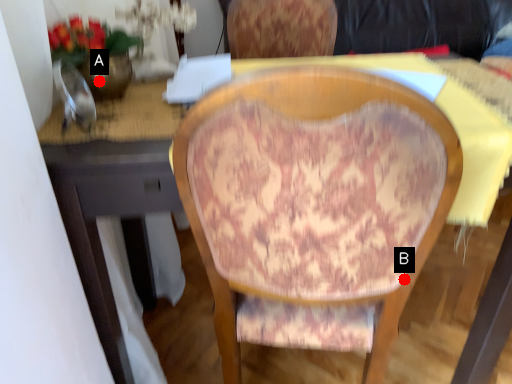
Question: Two points are circled on the image, labeled by A and B beside each circle. Which of the following is the farthest from the observer?

Choices:
 (A) A is further
 (B) B is further

Answer: (A)